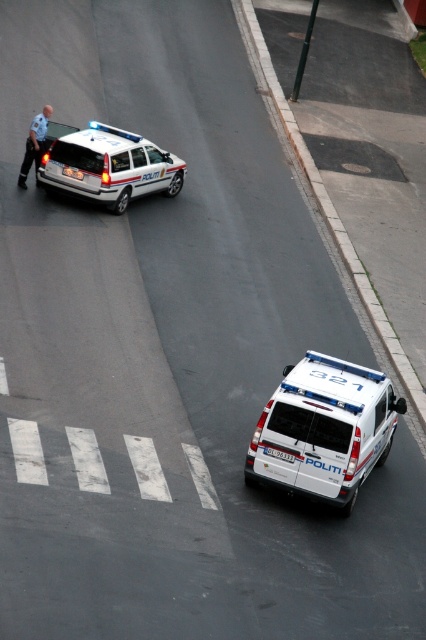
Between point (37, 173) and point (31, 145), which one is positioned in front?

Point (31, 145)

Between point (170, 188) and point (37, 125), which one is positioned in front?

Point (37, 125) is in front.

Identify the location of white glossy van at upper left. Image resolution: width=426 pixels, height=640 pixels. (109, 166).

Who is taller, white glossy van at upper left or white plastic license plate at center?

Standing taller between the two is white glossy van at upper left.

Looking at this image, is white glossy van at upper left wider than white plastic license plate at center?

Yes, white glossy van at upper left is wider than white plastic license plate at center.

Locate an element on the screen. This screenshot has width=426, height=640. white glossy van at upper left is located at coordinates (109, 166).

Where is `white glossy van at upper left`? This screenshot has height=640, width=426. white glossy van at upper left is located at coordinates (109, 166).

Based on the photo, which is below, light blue uniform at left or white plastic license plate at center?

white plastic license plate at center

Is point (43, 140) farther from camera compared to point (265, 448)?

Yes.

The height and width of the screenshot is (640, 426). In order to click on light blue uniform at left in this screenshot , I will do `click(34, 145)`.